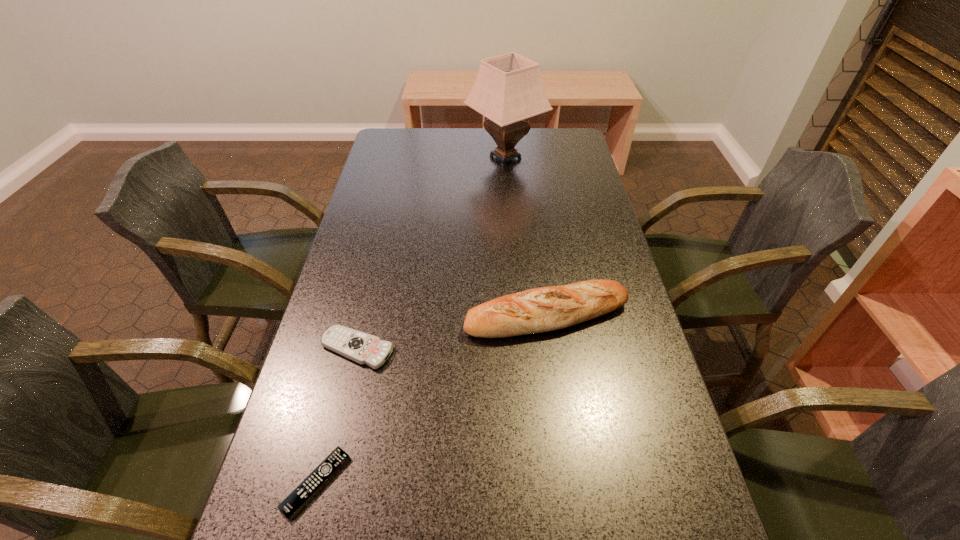
Image resolution: width=960 pixels, height=540 pixels. Find the location of `vacant area that lies between the taller remote control and the third shortest object`. vacant area that lies between the taller remote control and the third shortest object is located at coordinates (452, 332).

You are a GUI agent. You are given a task and a screenshot of the screen. Output one action in this format:
    pyautogui.click(x=<x>, y=<y>)
    Task: Click on the free area in between the lampshade and the nearer remote control
    
    Given the screenshot: What is the action you would take?
    pyautogui.click(x=411, y=320)

The height and width of the screenshot is (540, 960). I want to click on vacant space that is in between the baguet and the second shortest object, so click(x=452, y=332).

You are a GUI agent. You are given a task and a screenshot of the screen. Output one action in this format:
    pyautogui.click(x=<x>, y=<y>)
    Task: Click on the free space between the lampshade and the taller remote control
    The height and width of the screenshot is (540, 960).
    Given the screenshot: What is the action you would take?
    pyautogui.click(x=431, y=253)

Identify the location of free spot between the taller remote control and the tallest object. (431, 253).

Find the location of a particular element. This screenshot has height=540, width=960. vacant space that is in between the tallest object and the nearer remote control is located at coordinates (411, 320).

At what (x,y) coordinates should I click in order to perform the action: click on vacant point located between the tallest object and the shortest object. Please return your answer as a coordinate pair (x, y). Looking at the image, I should click on (411, 320).

Where is `empty location between the farthest object and the taller remote control`? Image resolution: width=960 pixels, height=540 pixels. empty location between the farthest object and the taller remote control is located at coordinates (431, 253).

Where is `vacant space that is in between the farthest object and the taller remote control`? The height and width of the screenshot is (540, 960). vacant space that is in between the farthest object and the taller remote control is located at coordinates (431, 253).

Where is `unoccupied position between the baguet and the second shortest object`? unoccupied position between the baguet and the second shortest object is located at coordinates (452, 332).